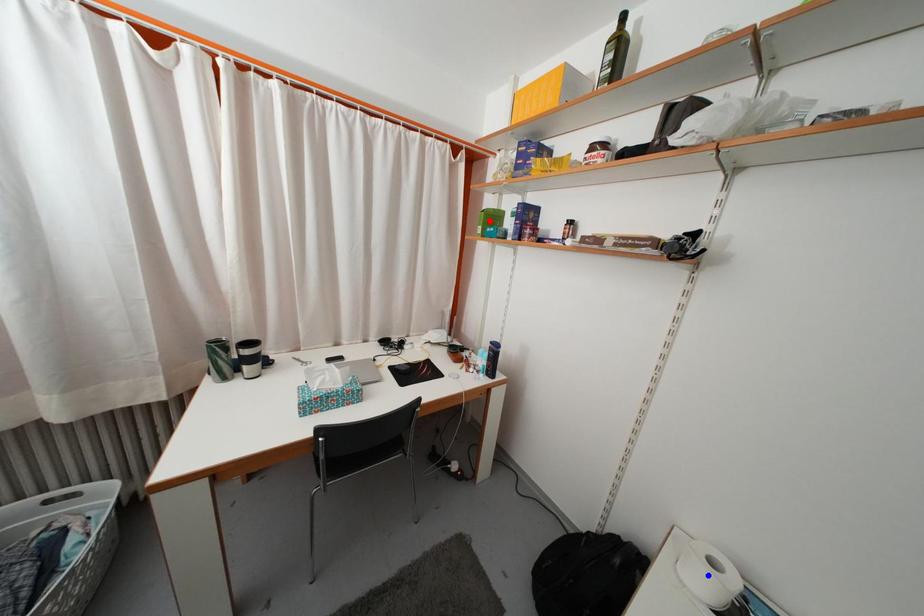
Question: In the image, two points are highlighted. Which point is nearer to the camera? Reply with the corresponding letter.

Choices:
 (A) blue point
 (B) red point

Answer: (A)